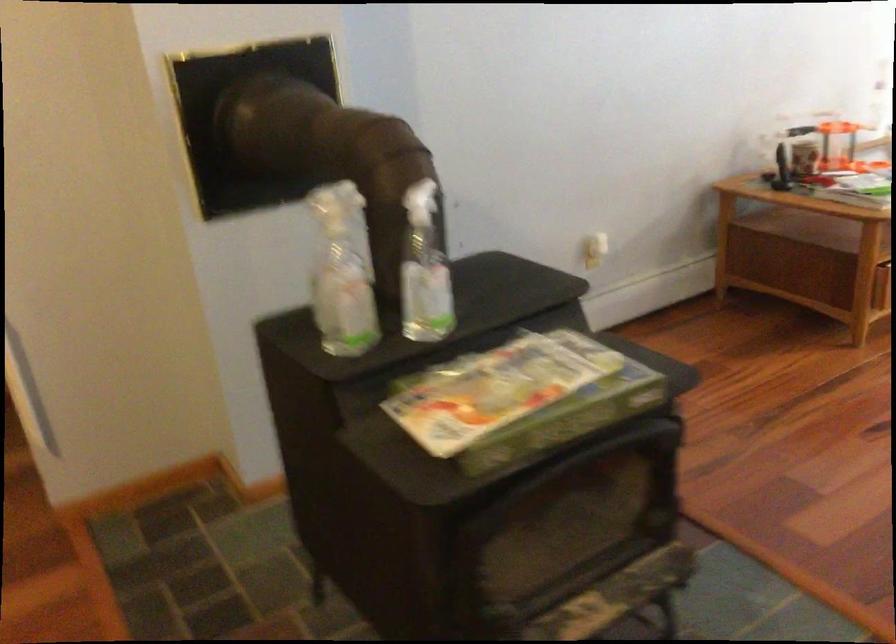
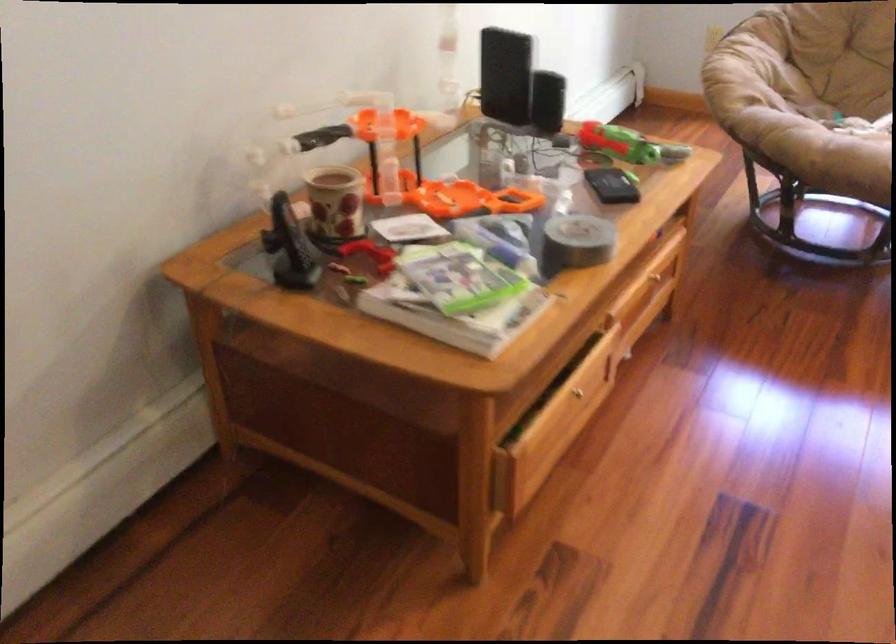
Where in the second image is the point corresponding to pixel 796 154 from the first image?

(334, 203)